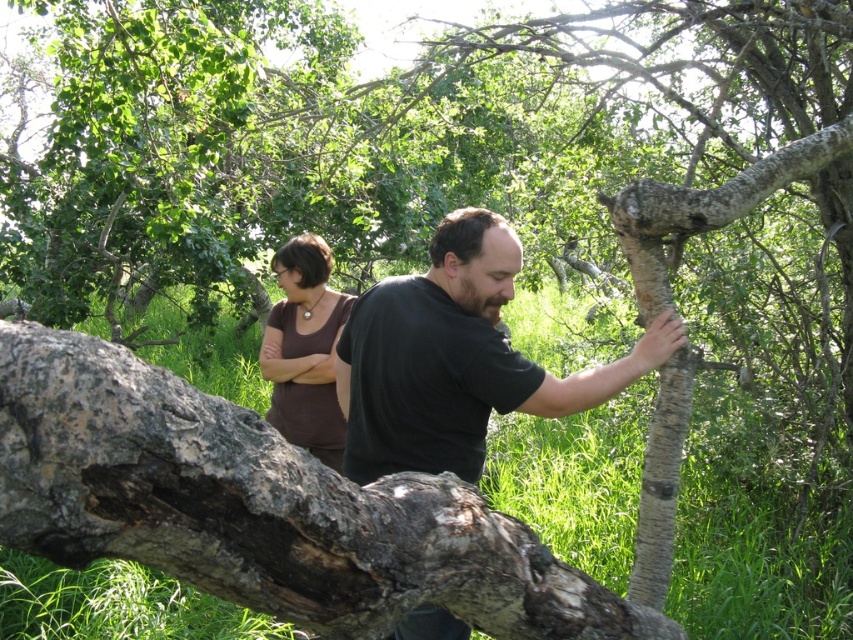
Between rough bark tree trunk at right and brown matte shirt at center, which one has less height?

Standing shorter between the two is brown matte shirt at center.

Does rough bark tree trunk at right have a larger size compared to brown matte shirt at center?

No, rough bark tree trunk at right is not bigger than brown matte shirt at center.

Is point (646, 193) closer to viewer compared to point (297, 282)?

Yes.

At what (x,y) coordinates should I click in order to perform the action: click on rough bark tree trunk at right. Please return your answer as a coordinate pair (x, y). This screenshot has width=853, height=640. Looking at the image, I should click on (660, 481).

Which is in front, point (413, 432) or point (335, 432)?

Point (413, 432)

Who is higher up, dark brown wood tree trunk at center or brown matte shirt at center?

→ dark brown wood tree trunk at center is higher up.

This screenshot has height=640, width=853. What do you see at coordinates (457, 358) in the screenshot?
I see `dark brown wood tree trunk at center` at bounding box center [457, 358].

At what (x,y) coordinates should I click in order to perform the action: click on dark brown wood tree trunk at center. Please return your answer as a coordinate pair (x, y). The width and height of the screenshot is (853, 640). Looking at the image, I should click on (457, 358).

Looking at this image, between dark brown wood tree trunk at center and smooth bark tree branch at upper right, which one appears on the left side from the viewer's perspective?

dark brown wood tree trunk at center

Is dark brown wood tree trunk at center positioned in front of smooth bark tree branch at upper right?

That is False.

Does point (451, 337) lie in front of point (720, 195)?

No, it is not.

Identify the location of dark brown wood tree trunk at center. The height and width of the screenshot is (640, 853). (457, 358).